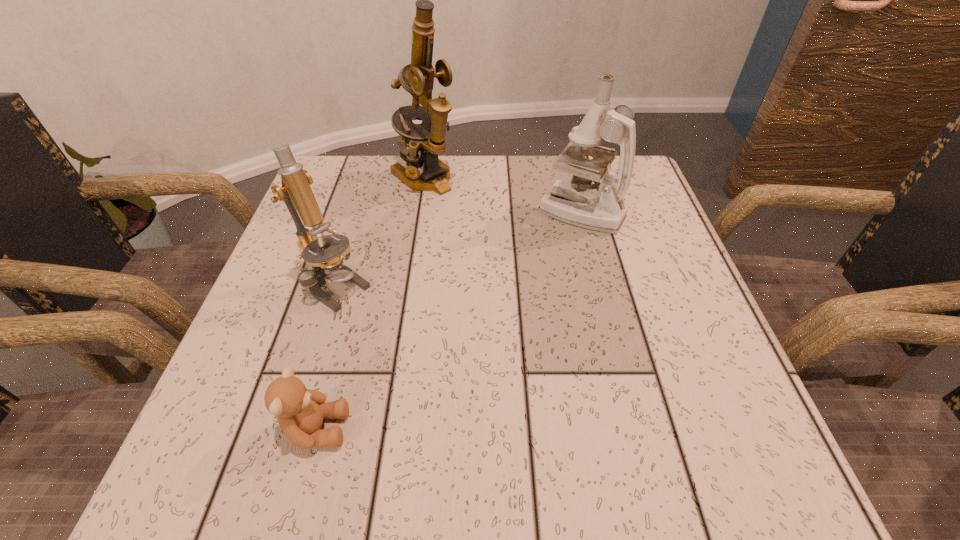
Locate an element on the screen. the tallest object is located at coordinates (417, 78).

Locate an element on the screen. This screenshot has width=960, height=540. the rightmost object is located at coordinates (576, 203).

I want to click on the nearest microscope, so click(327, 264).

Locate an element on the screen. the shortest object is located at coordinates (300, 411).

Locate an element on the screen. This screenshot has width=960, height=540. the nearest object is located at coordinates (300, 411).

Identify the location of vacant space situated 0.100m on the front of the tallest object. Image resolution: width=960 pixels, height=540 pixels. (417, 226).

You are a GUI agent. You are given a task and a screenshot of the screen. Output one action in this format:
    pyautogui.click(x=<x>, y=<y>)
    Task: Click on the free space located 0.140m on the back of the rightmost object
    
    Given the screenshot: What is the action you would take?
    pyautogui.click(x=567, y=160)

This screenshot has width=960, height=540. I want to click on vacant space located 0.380m on the back of the nearest microscope, so click(375, 163).

The image size is (960, 540). I want to click on free space located 0.370m on the front-facing side of the teddy bear, so click(604, 429).

I want to click on object present at the near edge, so click(x=300, y=411).